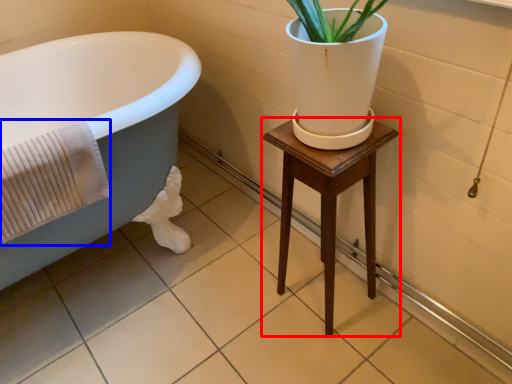
Question: Which object is further to the camera taking this photo, furniture (highlighted by a red box) or bath towel (highlighted by a blue box)?

Choices:
 (A) furniture
 (B) bath towel

Answer: (A)